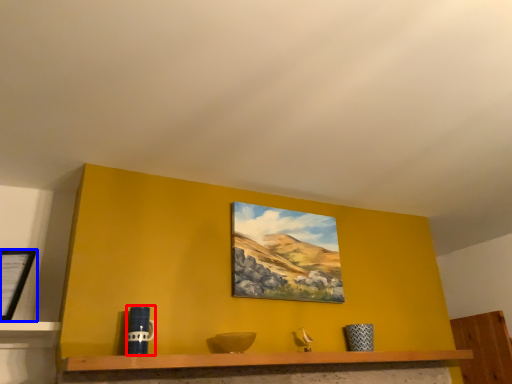
Question: Which of the following is the farthest to the observer, mug (highlighted by a red box) or picture frame (highlighted by a blue box)?

Choices:
 (A) mug
 (B) picture frame

Answer: (B)